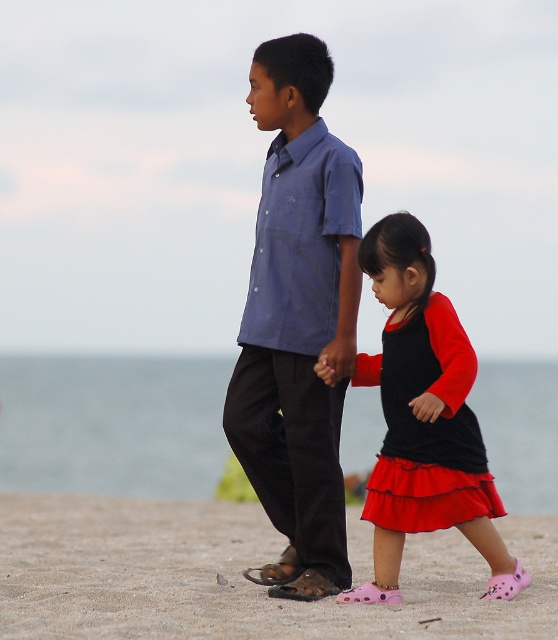
Does brown leather sandal at lower center have a larger size compared to pink croc sandal at lower right?

Indeed, brown leather sandal at lower center has a larger size compared to pink croc sandal at lower right.

What do you see at coordinates (276, 570) in the screenshot? I see `brown leather sandal at lower center` at bounding box center [276, 570].

Which is in front, point (281, 584) or point (512, 573)?

Point (512, 573) is in front.

Locate an element on the screen. The image size is (558, 640). brown leather sandal at lower center is located at coordinates (276, 570).

Can you confirm if sandy beach at lower center is positioned above pink croc sandal at lower right?

No, sandy beach at lower center is not above pink croc sandal at lower right.

Does sandy beach at lower center appear on the right side of pink croc sandal at lower right?

In fact, sandy beach at lower center is to the left of pink croc sandal at lower right.

Between point (489, 634) and point (517, 589), which one is positioned behind?

Point (517, 589)

In order to click on sandy beach at lower center in this screenshot , I will do `click(237, 576)`.

Who is more forward, (335, 252) or (430, 442)?

Point (430, 442)

Is matte blue shirt at center bigger than black matte dress at lower right?

Yes.

You are a GUI agent. You are given a task and a screenshot of the screen. Output one action in this format:
    pyautogui.click(x=<x>, y=<y>)
    Task: Click on the matte blue shirt at center
    This screenshot has width=558, height=640.
    Given the screenshot: What is the action you would take?
    pyautogui.click(x=299, y=314)

Where is `matte blue shirt at center`? The height and width of the screenshot is (640, 558). matte blue shirt at center is located at coordinates (299, 314).